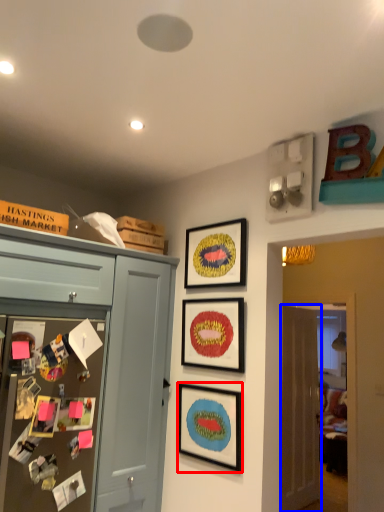
Question: Which object appears farthest to the camera in this image, picture frame (highlighted by a red box) or door (highlighted by a blue box)?

Choices:
 (A) picture frame
 (B) door

Answer: (B)